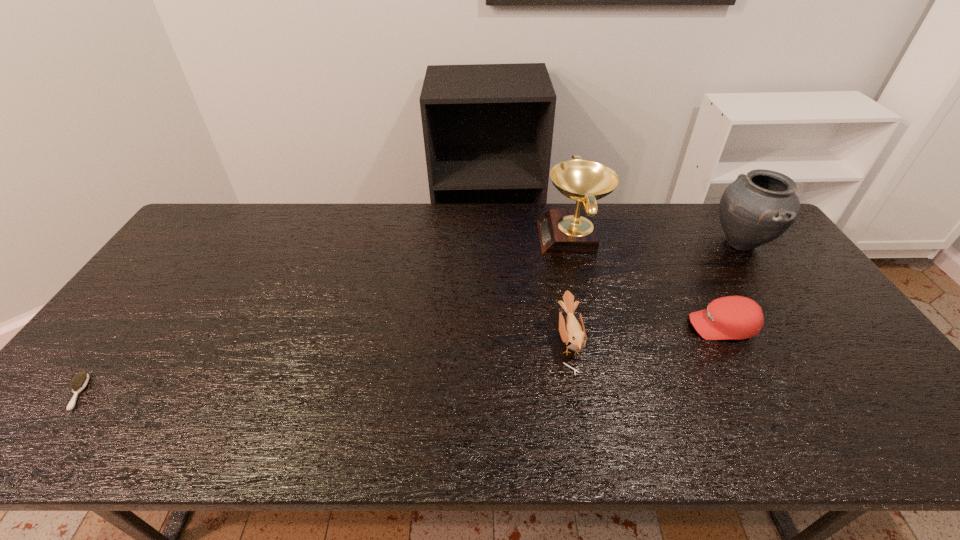
Where is `vacant area between the second object from right to left and the third shortest object`? vacant area between the second object from right to left and the third shortest object is located at coordinates (645, 334).

Find the location of `empty space that is in between the second object from right to left and the rightmost object`. empty space that is in between the second object from right to left and the rightmost object is located at coordinates [x=731, y=285].

Identify the location of vacant area that lies between the shortest object and the second object from right to left. This screenshot has height=540, width=960. (399, 359).

The width and height of the screenshot is (960, 540). Identify the location of free area in between the leftmost object and the second shortest object. (399, 359).

At what (x,y) coordinates should I click in order to perform the action: click on free space between the urn and the shortest object. Please return your answer as a coordinate pair (x, y). The width and height of the screenshot is (960, 540). Looking at the image, I should click on (409, 318).

This screenshot has height=540, width=960. What are the coordinates of `unoccupied position between the urn and the fourth tallest object` in the screenshot? It's located at [x=731, y=285].

Point out which object is positioned as the third nearest to the award. Please provide its 2D coordinates. Your answer should be formatted as a tuple, i.e. [(x, y)], where the tuple contains the x and y coordinates of a point satisfying the conditions above.

[(757, 208)]

Image resolution: width=960 pixels, height=540 pixels. I want to click on the second closest object to the rightmost object, so click(562, 231).

You are a GUI agent. You are given a task and a screenshot of the screen. Output one action in this format:
    pyautogui.click(x=<x>, y=<y>)
    Task: Click on the free space in the image that satisfies the following two spatial constraints: 1. on the front-facing side of the rightmost object; 2. on the left side of the award
    
    Given the screenshot: What is the action you would take?
    coord(573,242)

Locate an element on the screen. The width and height of the screenshot is (960, 540). vacant area that satisfies the following two spatial constraints: 1. on the front side of the urn; 2. on the front-facing side of the second object from right to left is located at coordinates (798, 326).